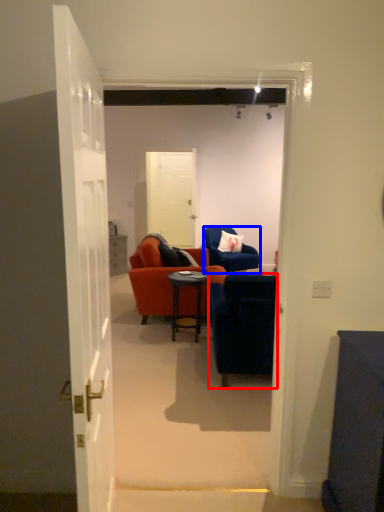
Question: Which object is further to the camera taking this photo, chair (highlighted by a red box) or chair (highlighted by a blue box)?

Choices:
 (A) chair
 (B) chair

Answer: (B)